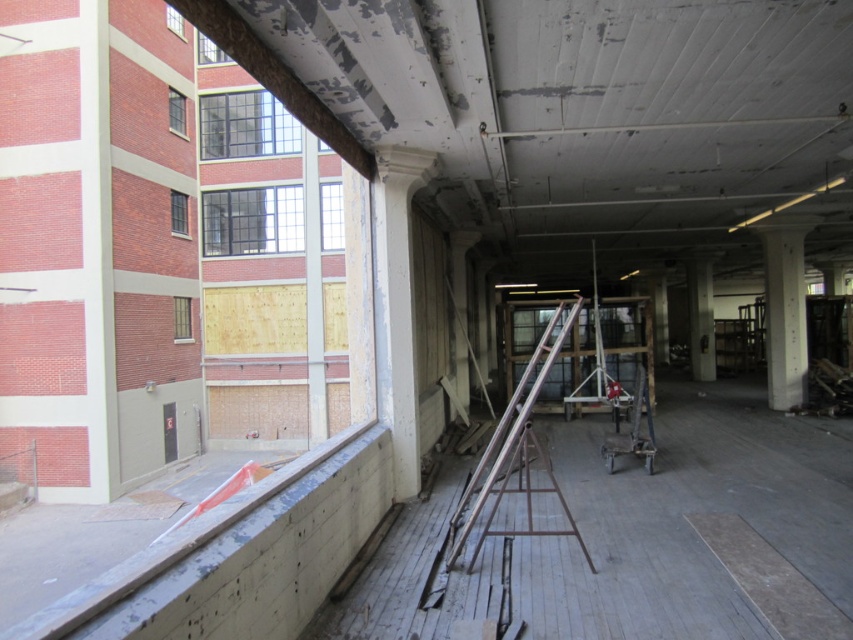
Question: Among these objects, which one is farthest from the camera?

Choices:
 (A) white smooth column at right
 (B) white glossy pillar at center
 (C) metallic silver ladder at center

Answer: (B)

Question: Which point is farther from the camera taking this photo?

Choices:
 (A) (473, 518)
 (B) (392, 317)
 (C) (688, 312)
 (D) (779, 349)

Answer: (C)

Question: Is white smooth column at right wider than white glossy pillar at center?

Choices:
 (A) no
 (B) yes

Answer: (B)

Question: Is white concrete column at center closer to the viewer compared to metallic silver ladder at center?

Choices:
 (A) yes
 (B) no

Answer: (B)

Question: Does white concrete column at center appear on the left side of white smooth column at right?

Choices:
 (A) yes
 (B) no

Answer: (A)

Question: Based on their relative distances, which object is farther from the white smooth column at right?

Choices:
 (A) white glossy pillar at center
 (B) metallic silver ladder at center

Answer: (B)